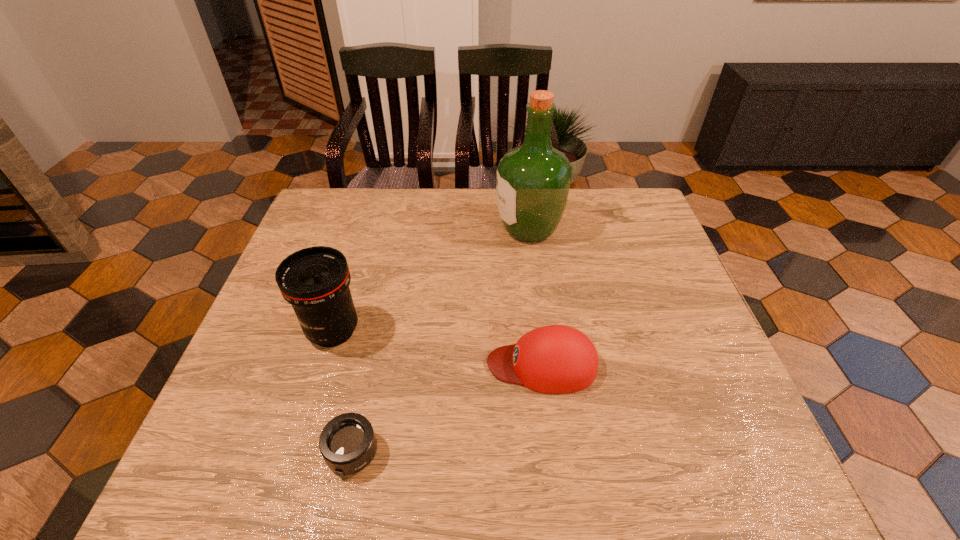
This screenshot has height=540, width=960. Find the location of `free space between the second shortest object and the shortest object`. free space between the second shortest object and the shortest object is located at coordinates click(447, 409).

Where is `free spot between the tallest object and the nearest object`? free spot between the tallest object and the nearest object is located at coordinates (441, 341).

The height and width of the screenshot is (540, 960). I want to click on free space between the baseball cap and the farther telephoto lens, so click(438, 348).

Identify which object is the nearest to the shortest object. Please provide its 2D coordinates. Your answer should be formatted as a tuple, i.e. [(x, y)], where the tuple contains the x and y coordinates of a point satisfying the conditions above.

[(315, 281)]

Identify which object is located as the third nearest to the baseball cap. Please provide its 2D coordinates. Your answer should be formatted as a tuple, i.e. [(x, y)], where the tuple contains the x and y coordinates of a point satisfying the conditions above.

[(533, 180)]

This screenshot has width=960, height=540. In order to click on free spot that satisfies the following two spatial constraints: 1. on the front-facing side of the baseball cap; 2. on the side of the nearer telephoto lens with brand markings and control switches in this screenshot , I will do `click(553, 453)`.

You are a GUI agent. You are given a task and a screenshot of the screen. Output one action in this format:
    pyautogui.click(x=<x>, y=<y>)
    Task: Click on the free space that satisfies the following two spatial constraints: 1. on the front-facing side of the second shortest object; 2. on the side of the nearest object with brand markings and control switches
    This screenshot has width=960, height=540.
    Given the screenshot: What is the action you would take?
    pyautogui.click(x=553, y=453)

Identify the location of vacant area that satisfies the following two spatial constraints: 1. on the front-facing side of the tallest object; 2. on the side of the shorter telephoto lens with brand markings and control switches. (558, 453).